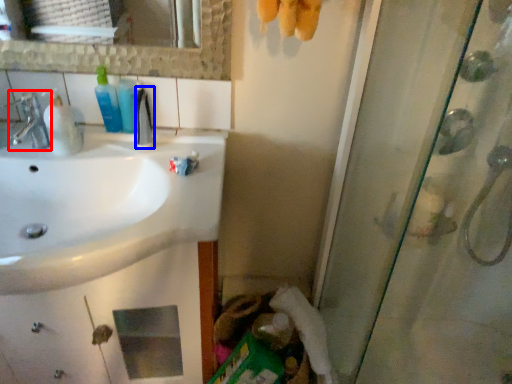
Question: Which of the following is the farthest to the observer, tap (highlighted by a red box) or mouthwash (highlighted by a blue box)?

Choices:
 (A) tap
 (B) mouthwash

Answer: (B)